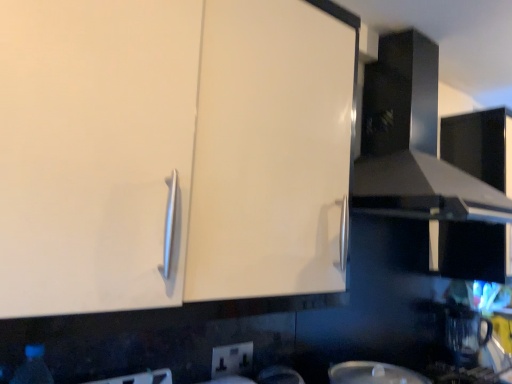
Question: Is point (228, 375) closer or farther from the camera than point (17, 367)?

Choices:
 (A) closer
 (B) farther

Answer: (B)

Question: Based on their positions, is white plastic electric outlet at lower center located to the left or right of transparent plastic bottle at lower left?

Choices:
 (A) left
 (B) right

Answer: (B)

Question: Estimate the real-world distances between objects in this image. Which object is farther from the white glossy cabinet at upper left?

Choices:
 (A) white glossy plate at lower center
 (B) glossy black exhaust hood at upper right
 (C) white plastic electric outlet at lower center
 (D) transparent plastic coffee machine at lower right
 (E) transparent plastic bottle at lower left

Answer: (D)

Question: Which is nearer to the transparent plastic coffee machine at lower right?

Choices:
 (A) white glossy plate at lower center
 (B) transparent plastic bottle at lower left
 (C) glossy black exhaust hood at upper right
 (D) white glossy cabinet at upper left
 (E) white plastic electric outlet at lower center

Answer: (A)